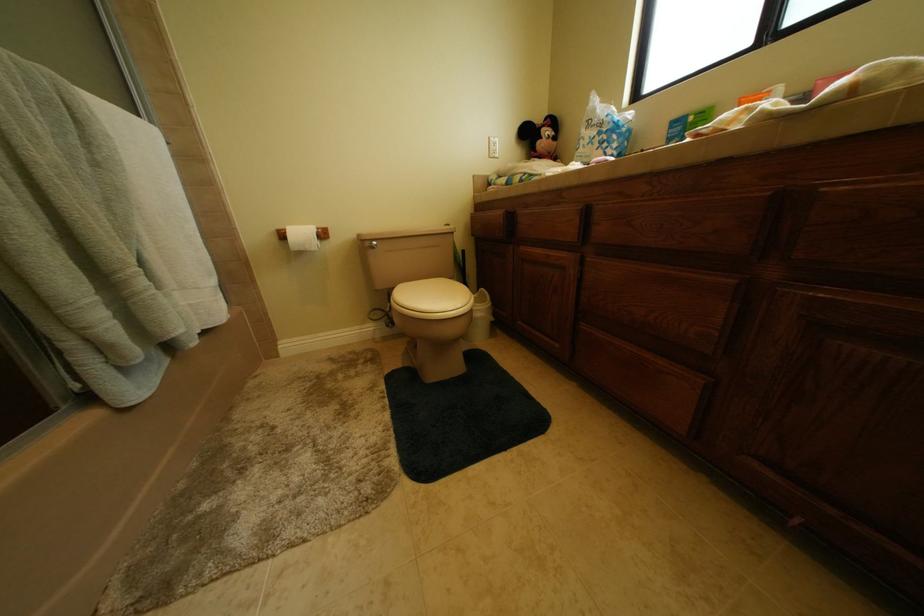
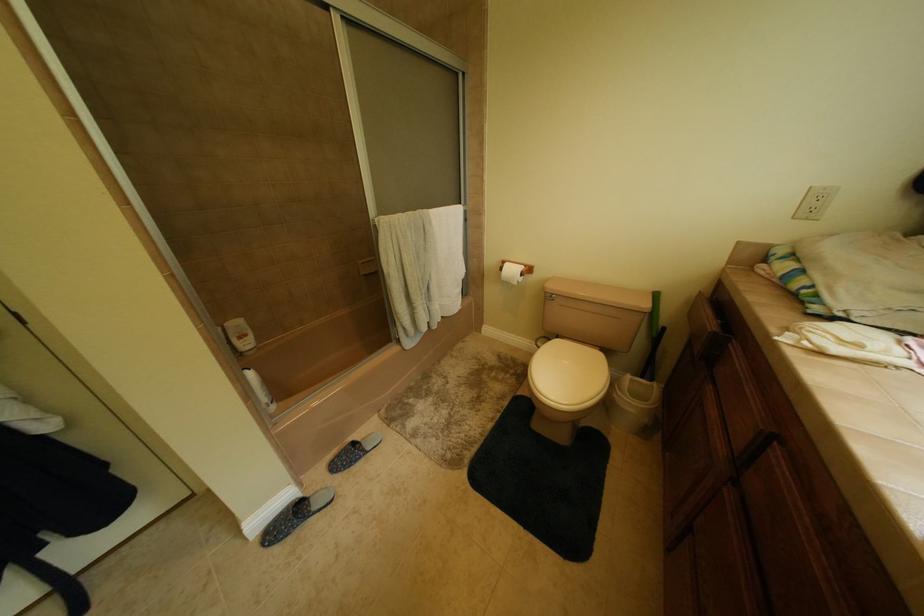
How did the camera likely rotate?

The camera rotated toward left-down.